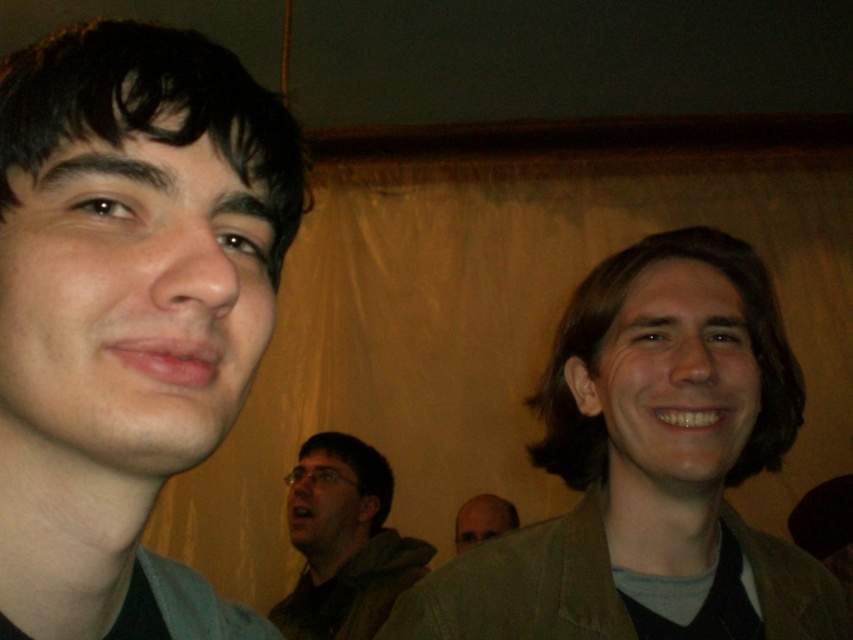
You are a photographer setting up a shot for a group photo. You notice the green fabric jacket at lower center and the bald head at center. Which object should you adjust to ensure both are fully visible in the frame?

The green fabric jacket at lower center is in front of the bald head at center. To ensure both are fully visible, adjust the position of the green fabric jacket at lower center so it is moved aside or repositioned to not block the bald head at center.

You are a photographer trying to adjust your camera focus. You notice the green fabric jacket at lower center and the bald head at center are both in the frame. Which object should you focus on first if you want to capture the larger one clearly?

The green fabric jacket at lower center is larger in size than the bald head at center, so you should focus on the green fabric jacket at lower center first to capture the larger one clearly.